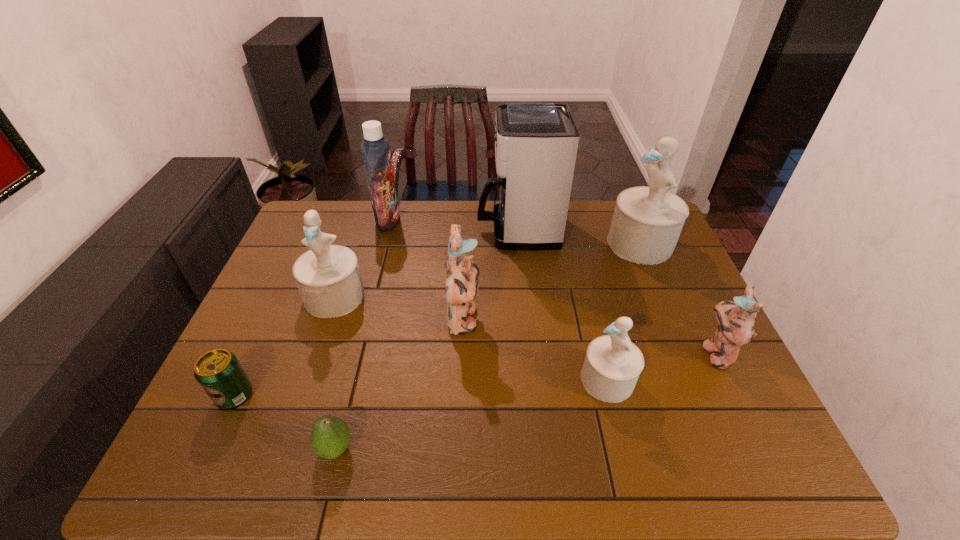
Where is `vacant region at the left edge of the desktop`? Image resolution: width=960 pixels, height=540 pixels. vacant region at the left edge of the desktop is located at coordinates (258, 429).

You are a GUI agent. You are given a task and a screenshot of the screen. Output one action in this format:
    pyautogui.click(x=<x>, y=<y>)
    Task: Click on the vacant point at the right edge
    
    Given the screenshot: What is the action you would take?
    pyautogui.click(x=737, y=417)

Image resolution: width=960 pixels, height=540 pixels. I want to click on free space between the coffee maker and the second biggest white figurine, so click(426, 263).

Find the location of a particular element. This screenshot has width=960, height=540. empty space between the bigger pink figurine and the third figurine from left to right is located at coordinates (536, 350).

At what (x,y) coordinates should I click in order to perform the action: click on free space between the avocado and the leftmost object. Please return your answer as a coordinate pair (x, y). This screenshot has height=540, width=960. Looking at the image, I should click on (285, 422).

The width and height of the screenshot is (960, 540). What are the coordinates of `empty space between the rightmost white figurine and the beer can` in the screenshot? It's located at (438, 320).

This screenshot has height=540, width=960. I want to click on free space between the rightmost white figurine and the avocado, so click(x=488, y=346).

Identify the location of vacant space in between the coffee maker and the nearest white figurine. The height and width of the screenshot is (540, 960). (563, 305).

Find the location of a particular element. The height and width of the screenshot is (540, 960). vacant region between the leftmost white figurine and the nearest object is located at coordinates (335, 373).

Identify the location of free space that is in between the blue shampoo and the smallest white figurine. (497, 300).